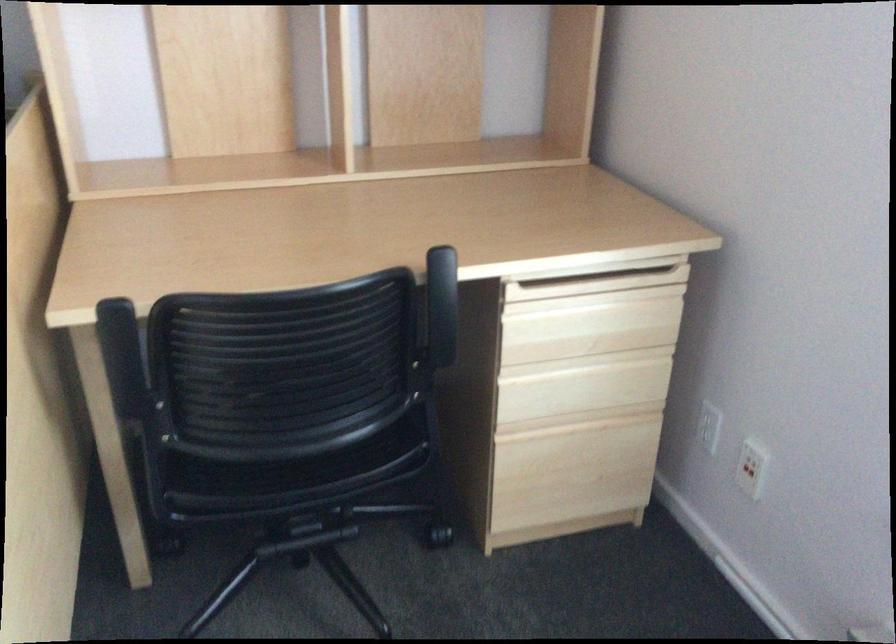
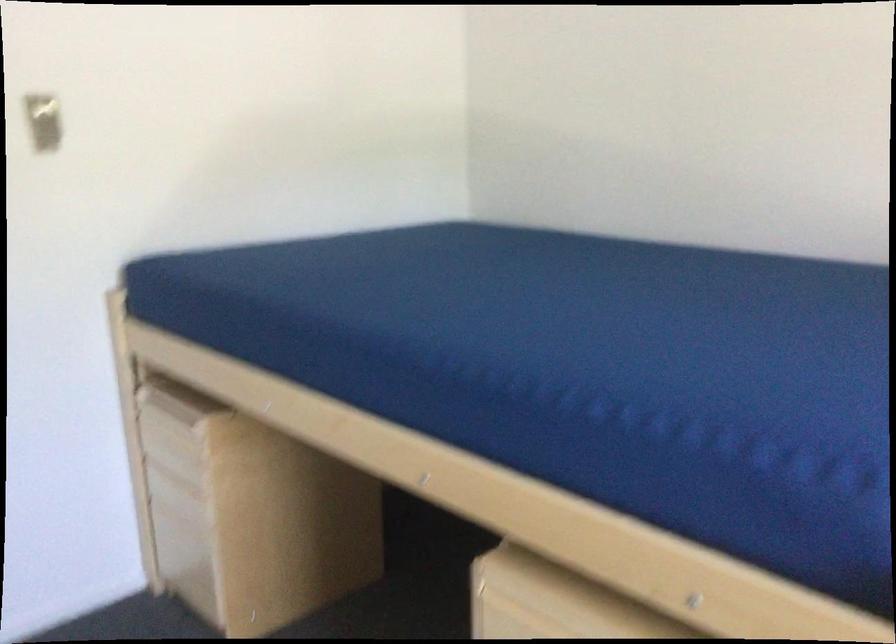
Question: How did the camera likely rotate?

Choices:
 (A) Left
 (B) Right
 (C) Up
 (D) Down

Answer: (A)